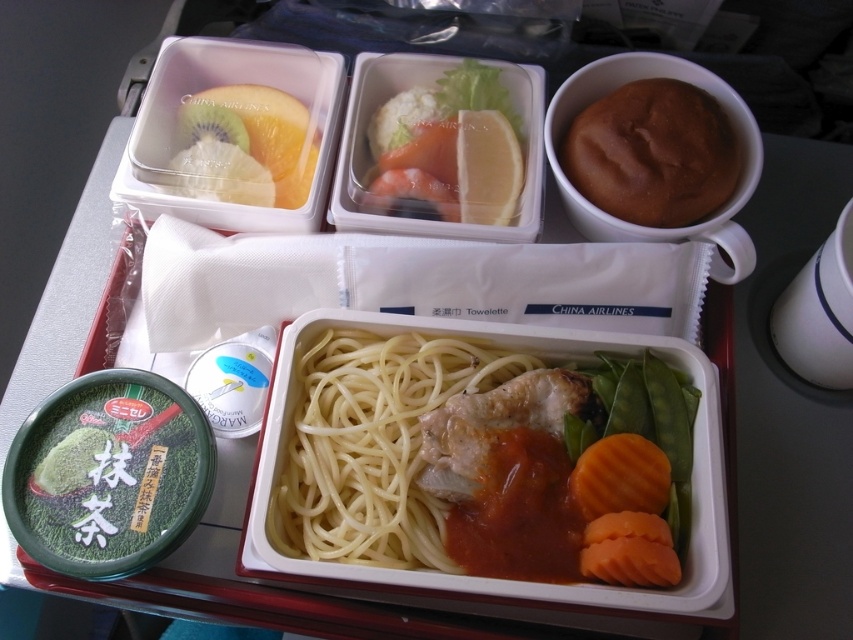
Question: Is yellow matte noodles at center to the left of brown matte bread roll at upper right from the viewer's perspective?

Choices:
 (A) no
 (B) yes

Answer: (B)

Question: Does yellow matte noodles at center have a greater width compared to brown matte bread roll at upper right?

Choices:
 (A) yes
 (B) no

Answer: (A)

Question: Which point is closer to the camera taking this photo?

Choices:
 (A) (697, 157)
 (B) (511, 378)

Answer: (A)

Question: Does yellow matte noodles at center have a lesser width compared to brown matte bread roll at upper right?

Choices:
 (A) no
 (B) yes

Answer: (A)